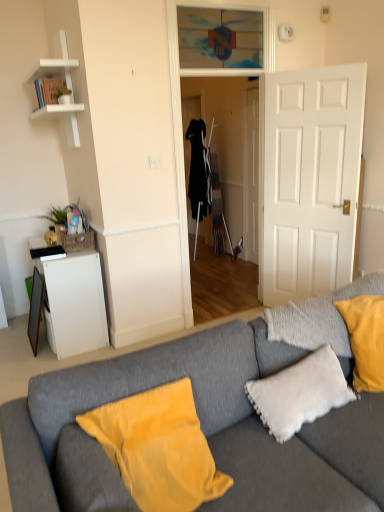
Locate an element on the screen. The width and height of the screenshot is (384, 512). free region under transparent glass door at upper center (from a real-world perspective) is located at coordinates click(219, 70).